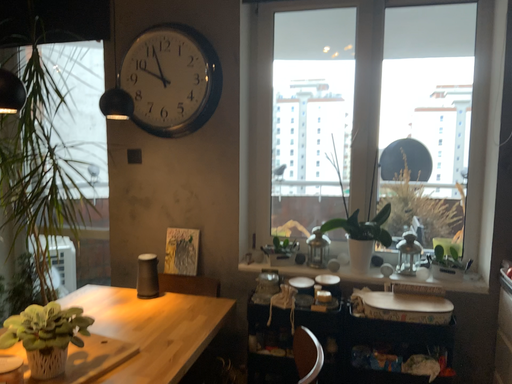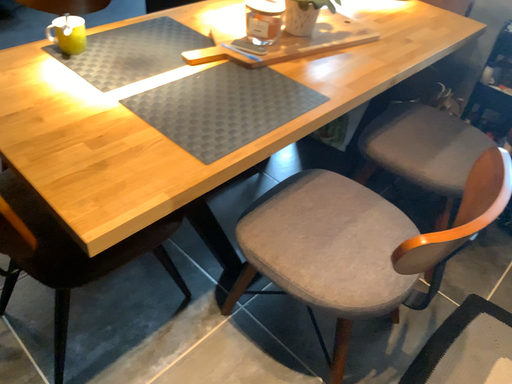
Question: How did the camera likely rotate when shooting the video?

Choices:
 (A) rotated left
 (B) rotated right

Answer: (A)